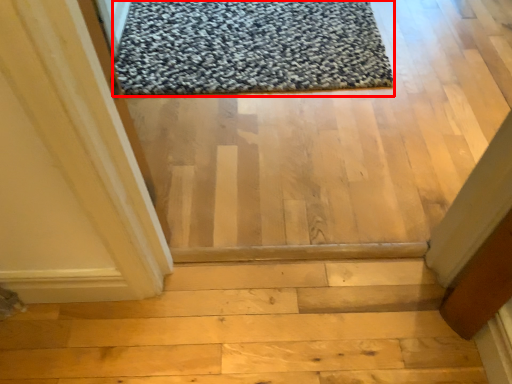
Question: From the image, what is the correct spatial relationship of mat (annotated by the red box) in relation to stairwell?

Choices:
 (A) left
 (B) right

Answer: (B)